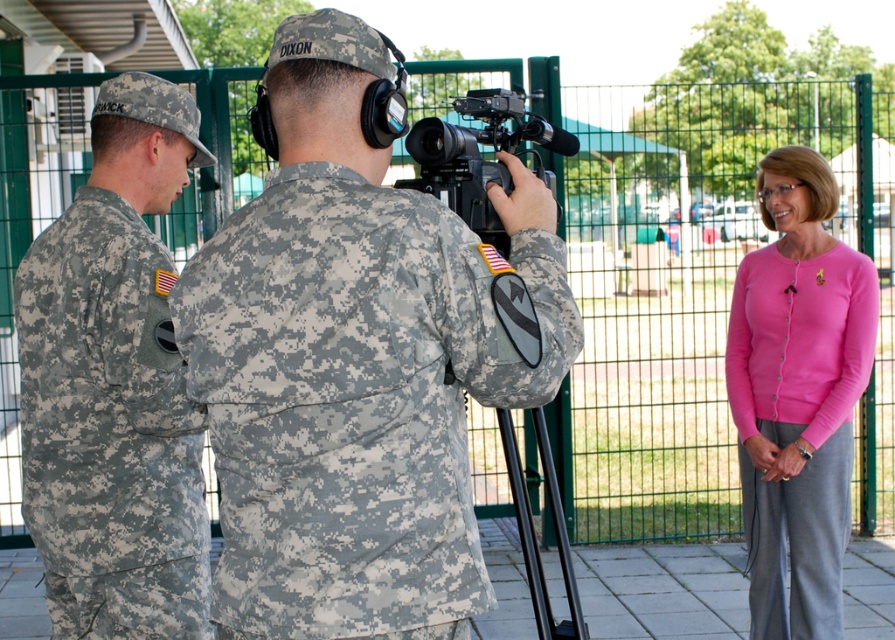
Who is positioned more to the left, camouflage uniform at center or camouflage fabric uniform at left?

Positioned to the left is camouflage fabric uniform at left.

Measure the distance from camouflage uniform at center to camouflage fabric uniform at left.

The distance of camouflage uniform at center from camouflage fabric uniform at left is 32.07 inches.

The width and height of the screenshot is (895, 640). What are the coordinates of `camouflage uniform at center` in the screenshot? It's located at (358, 362).

Find the location of a particular element. This screenshot has height=640, width=895. camouflage uniform at center is located at coordinates (358, 362).

Does camouflage uniform at center appear under black plastic camera at center?

Yes.

Is camouflage uniform at center further to camera compared to black plastic camera at center?

That is False.

Find the location of `camouflage uniform at center`. camouflage uniform at center is located at coordinates (358, 362).

Is camouflage uniform at center below pink cardigan at right?

No.

Which of these two, camouflage uniform at center or pink cardigan at right, stands shorter?

camouflage uniform at center is shorter.

Where is `camouflage uniform at center`? The width and height of the screenshot is (895, 640). camouflage uniform at center is located at coordinates (358, 362).